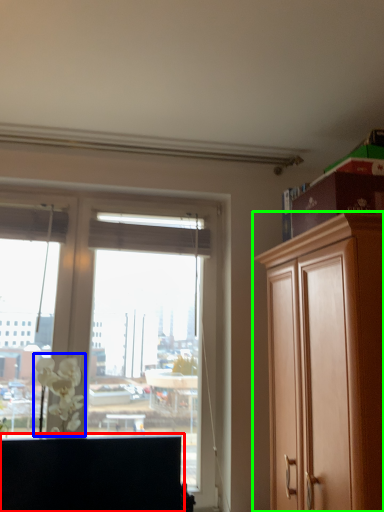
Question: Which object is positioned closest to cabinetry (highlighted by a red box)? Select from flower (highlighted by a blue box) and cabinetry (highlighted by a green box).

Choices:
 (A) flower
 (B) cabinetry

Answer: (A)